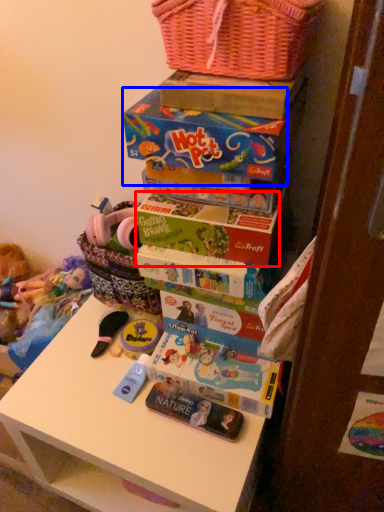
Question: Which of the following is the closest to the observer, book (highlighted by a red box) or storage box (highlighted by a blue box)?

Choices:
 (A) book
 (B) storage box

Answer: (B)